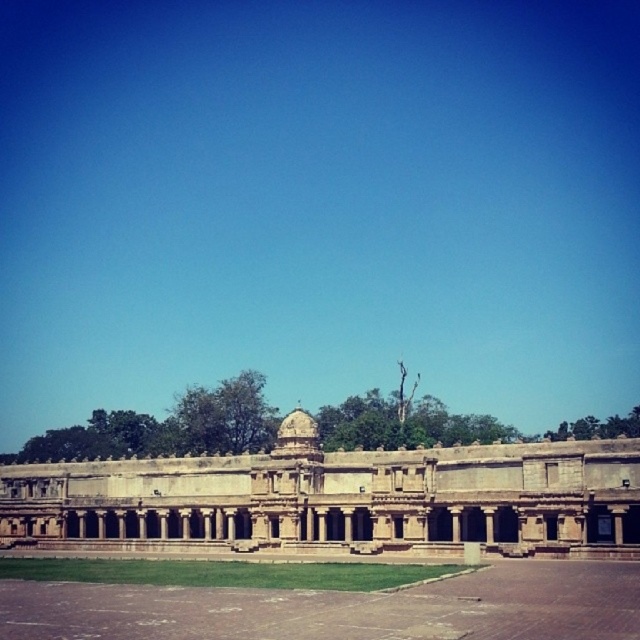
You are standing in the courtyard of the grand architectural structure shown in the image. You notice a point marked at coordinates [337,499]. What does this point indicate?

The point at coordinates [337,499] marks the beige stone palace at center.

You are a landscape architect designing a new garden. You need to place a small decorative fountain in the courtyard. Given the beige stone palace at center and the green grass at center, which object should the fountain be placed closer to, considering their sizes?

The fountain should be placed closer to the green grass at center because the beige stone palace at center is larger and may dominate the space, making the smaller green grass area a better location for the fountain to maintain balance.